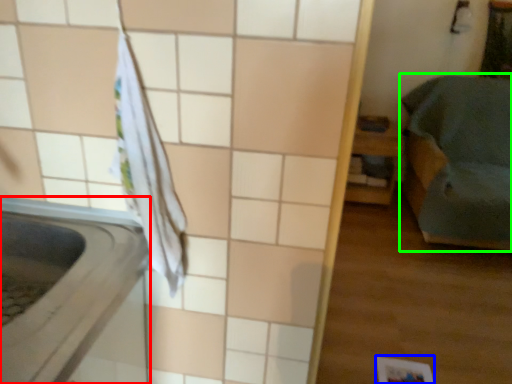
Question: Which object is positioned farthest from appliance (highlighted by a red box)? Select from square (highlighted by a blue box) and furniture (highlighted by a green box).

Choices:
 (A) square
 (B) furniture

Answer: (B)